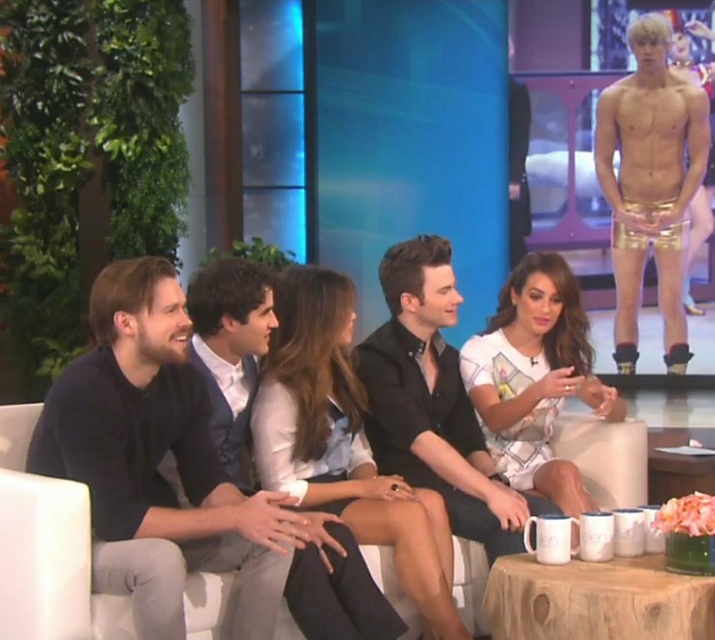
In the scene shown: Does black satin shirt at center appear over white printed dress at center?

No, black satin shirt at center is not above white printed dress at center.

Is point (400, 269) closer to viewer compared to point (516, 337)?

That is True.

At what (x,y) coordinates should I click in order to perform the action: click on black satin shirt at center. Please return your answer as a coordinate pair (x, y). The height and width of the screenshot is (640, 715). Looking at the image, I should click on (433, 401).

Between gold metallic shorts at upper right and white printed dress at center, which one appears on the right side from the viewer's perspective?

Positioned to the right is gold metallic shorts at upper right.

In the scene shown: Is gold metallic shorts at upper right to the left of white printed dress at center from the viewer's perspective?

No, gold metallic shorts at upper right is not to the left of white printed dress at center.

Does point (659, 108) come behind point (558, 467)?

Yes, it is behind point (558, 467).

Identify the location of gold metallic shorts at upper right. (650, 184).

Is point (129, 636) in front of point (247, 314)?

That is True.

Is white fabric couch at center wider than dark blue suit at center?

Yes, white fabric couch at center is wider than dark blue suit at center.

Is point (470, 618) closer to camera compared to point (217, 352)?

No, (470, 618) is behind (217, 352).

Locate an element on the screen. white fabric couch at center is located at coordinates (46, 548).